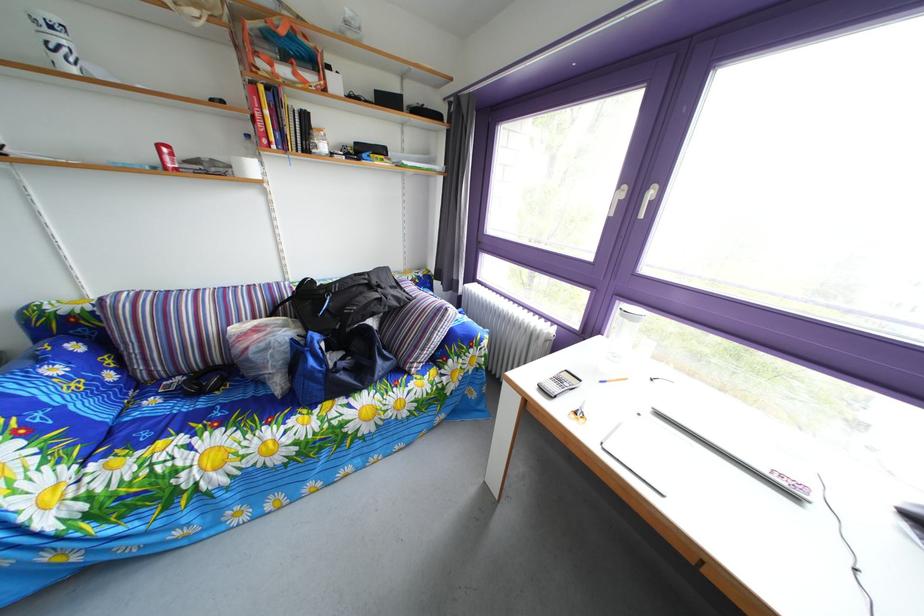
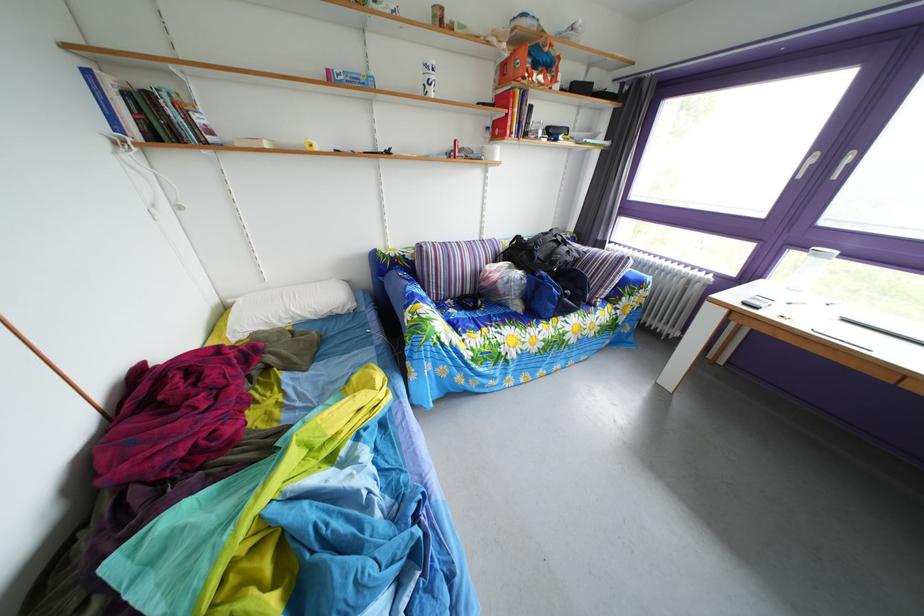
Where in the second image is the point corresponding to the point at 41,371 from the first image?

(417, 290)